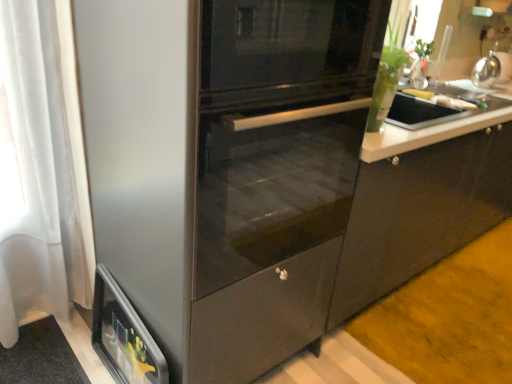
Question: Is stainless steel fridge at center positioned before yellow matte banana at upper right, which is counted as the second food, starting from the front?

Choices:
 (A) yes
 (B) no

Answer: (A)

Question: Does stainless steel fridge at center have a lesser width compared to yellow matte banana at upper right, which is counted as the second food, starting from the front?

Choices:
 (A) no
 (B) yes

Answer: (A)

Question: From the image's perspective, is stainless steel fridge at center beneath yellow matte banana at upper right, which is counted as the second food, starting from the front?

Choices:
 (A) yes
 (B) no

Answer: (A)

Question: Does stainless steel fridge at center turn towards yellow matte banana at upper right, which is counted as the second food, starting from the front?

Choices:
 (A) yes
 (B) no

Answer: (B)

Question: Does stainless steel fridge at center have a greater width compared to yellow matte banana at upper right, which is counted as the second food, starting from the front?

Choices:
 (A) no
 (B) yes

Answer: (B)

Question: Is stainless steel fridge at center behind yellow matte banana at upper right, the 1th food when ordered from back to front?

Choices:
 (A) yes
 (B) no

Answer: (B)

Question: Is satin silver kettle at upper right looking in the opposite direction of yellow matte banana at upper right, the 1th food when ordered from back to front?

Choices:
 (A) yes
 (B) no

Answer: (B)

Question: Considering the relative sizes of satin silver kettle at upper right and yellow matte banana at upper right, the 1th food when ordered from back to front, in the image provided, is satin silver kettle at upper right taller than yellow matte banana at upper right, the 1th food when ordered from back to front,?

Choices:
 (A) no
 (B) yes

Answer: (B)

Question: Does satin silver kettle at upper right lie behind yellow matte banana at upper right, the 1th food when ordered from back to front?

Choices:
 (A) yes
 (B) no

Answer: (A)

Question: From a real-world perspective, is satin silver kettle at upper right beneath yellow matte banana at upper right, the 1th food when ordered from back to front?

Choices:
 (A) yes
 (B) no

Answer: (B)

Question: Considering the relative positions of satin silver kettle at upper right and yellow matte banana at upper right, the 1th food when ordered from back to front, in the image provided, is satin silver kettle at upper right to the right of yellow matte banana at upper right, the 1th food when ordered from back to front, from the viewer's perspective?

Choices:
 (A) yes
 (B) no

Answer: (A)

Question: Can you confirm if satin silver kettle at upper right is thinner than yellow matte banana at upper right, which is counted as the second food, starting from the front?

Choices:
 (A) no
 (B) yes

Answer: (A)

Question: Is yellow matte banana at upper right, which is counted as the second food, starting from the front, turned away from satin silver kettle at upper right?

Choices:
 (A) no
 (B) yes

Answer: (A)